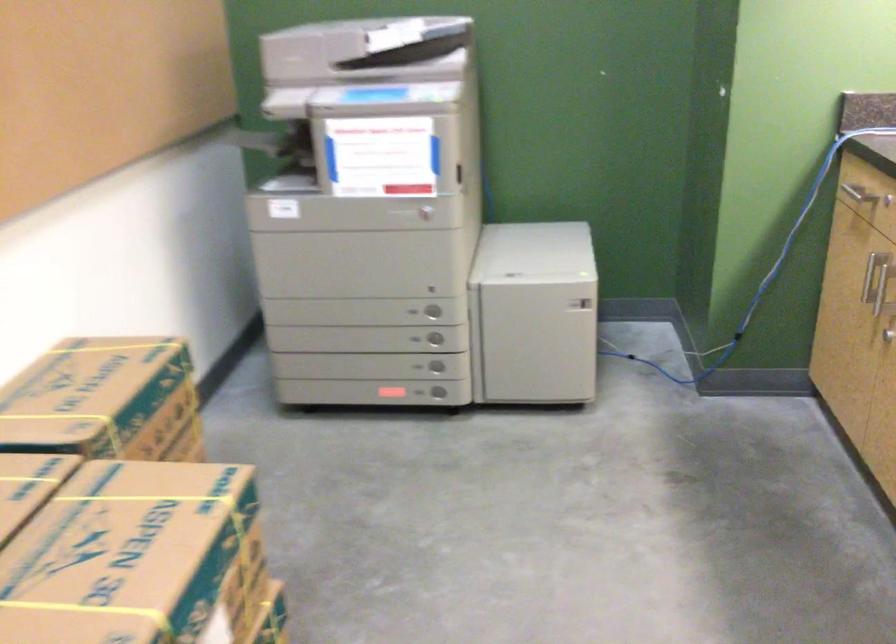
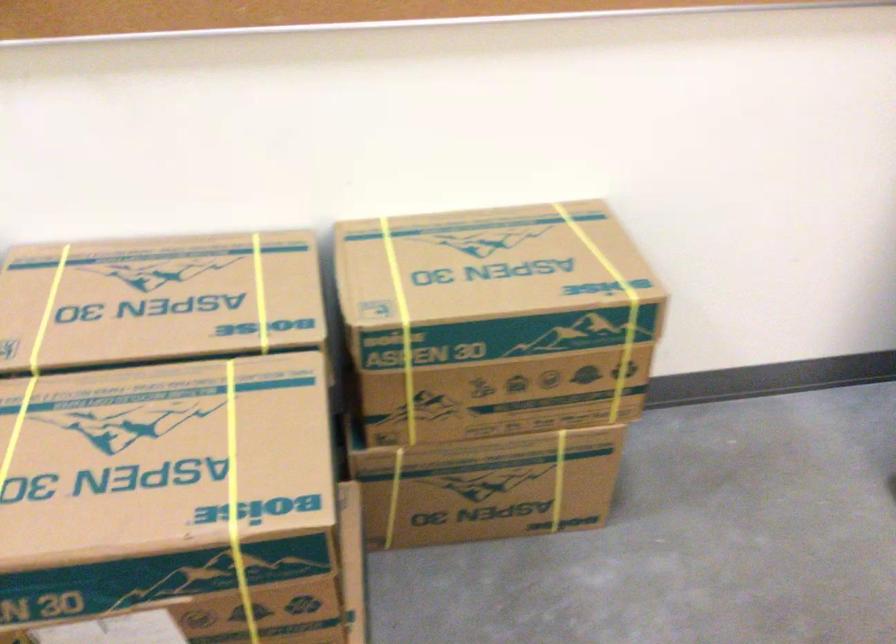
Locate, in the second image, the point that corresponds to (179,353) in the first image.

(609, 304)